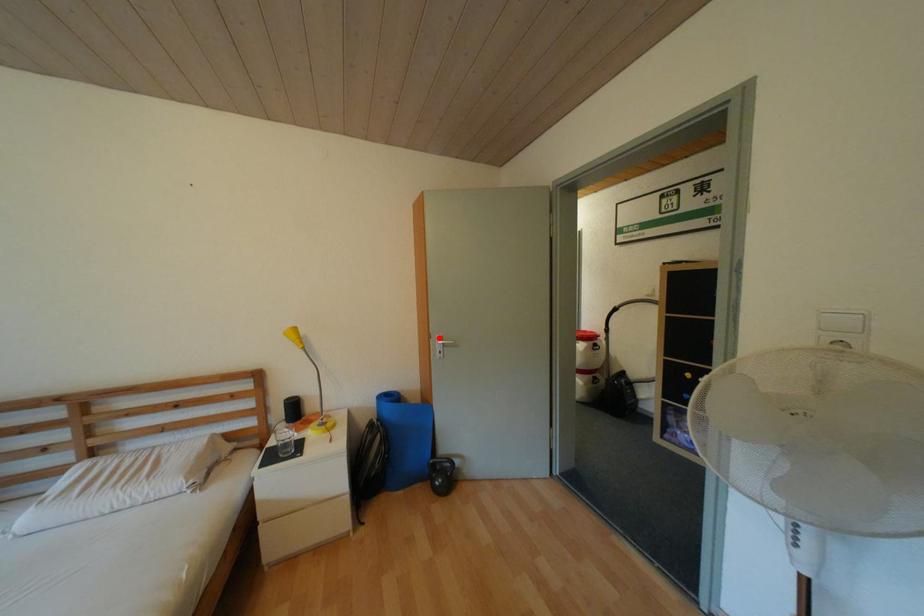
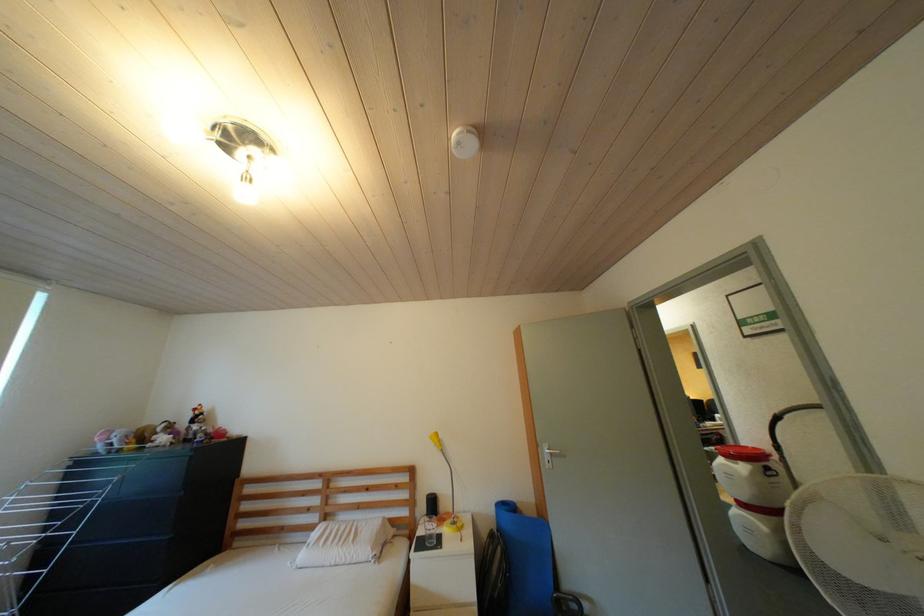
The point at the highlighted location is marked in the first image. Where is the corresponding point in the second image?

(546, 447)